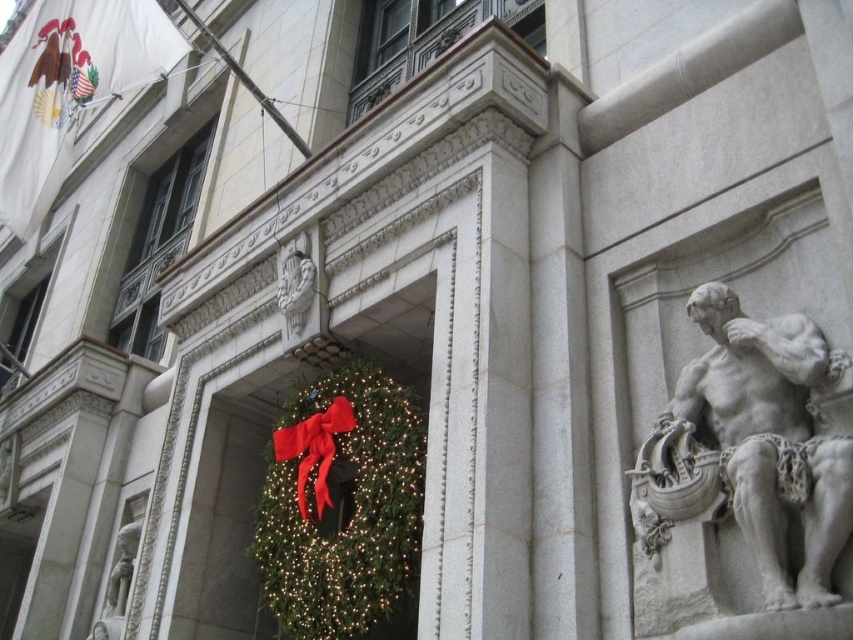
Does white stone statue at right have a lesser height compared to green textured wreath at center?

Answer: Correct, white stone statue at right is not as tall as green textured wreath at center.

Who is positioned more to the left, white stone statue at right or green textured wreath at center?

green textured wreath at center

Does point (805, 332) lie in front of point (363, 593)?

That is True.

Locate an element on the screen. This screenshot has height=640, width=853. white stone statue at right is located at coordinates (752, 448).